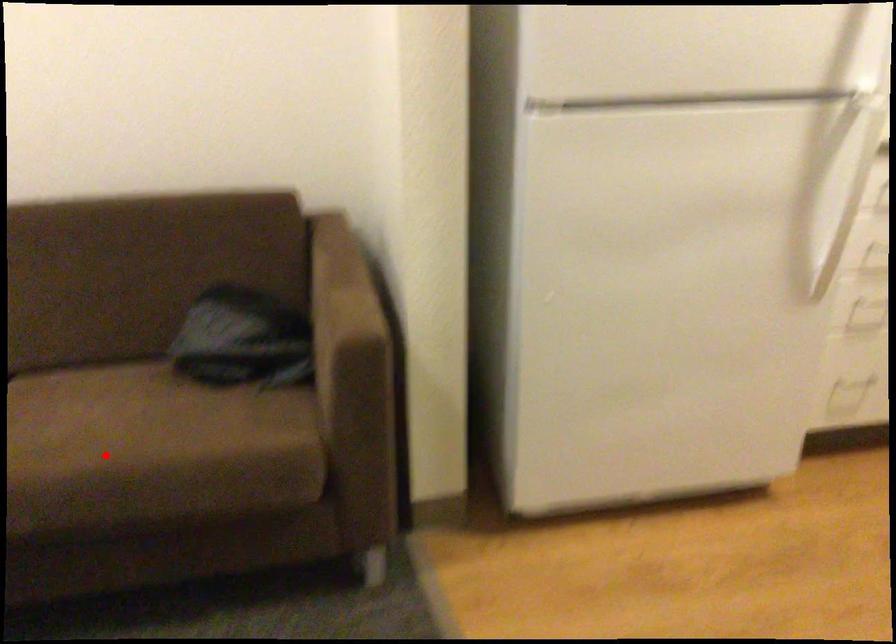
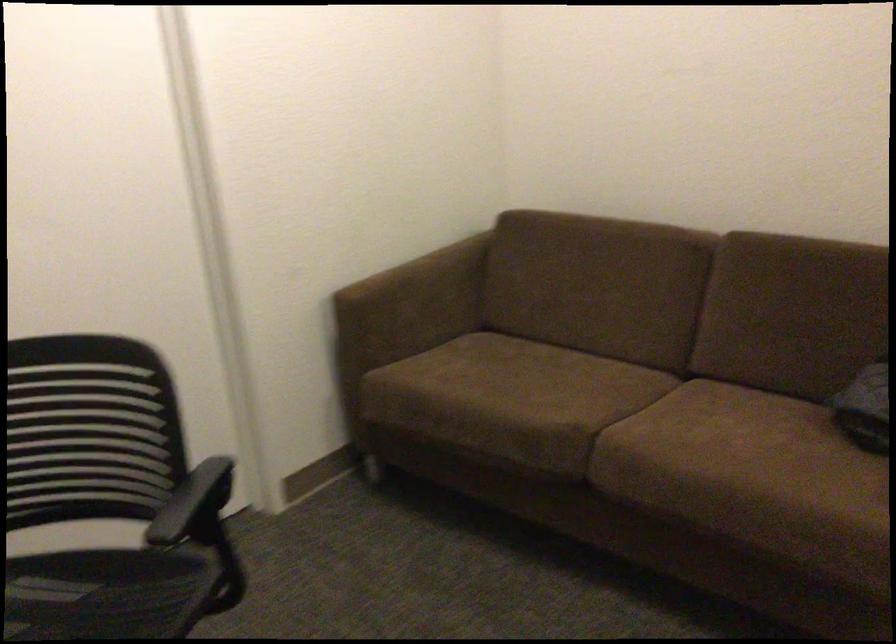
Locate, in the second image, the point that corresponds to the highlighted location in the first image.

(726, 462)